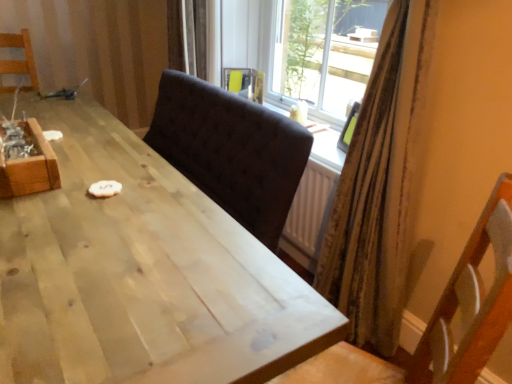
The height and width of the screenshot is (384, 512). I want to click on vacant space behind wooden crate at left, so click(x=79, y=141).